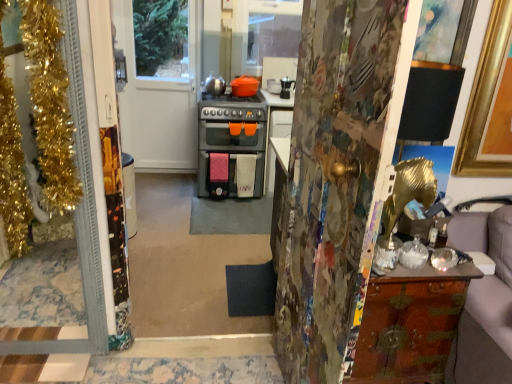
Where is `white glossy door at upper center, the 1th door from the back`? white glossy door at upper center, the 1th door from the back is located at coordinates (158, 83).

Locate an element on the screen. Image resolution: width=512 pixels, height=384 pixels. white glossy door at upper center, placed as the 3th door when sorted from front to back is located at coordinates (158, 83).

What's the angular difference between painted wood door at center, which is the 3th door in back-to-front order, and white glossy door at upper center, which is the 2th door in right-to-left order,'s facing directions?

84.4 degrees separate the facing orientations of painted wood door at center, which is the 3th door in back-to-front order, and white glossy door at upper center, which is the 2th door in right-to-left order.

At what (x,y) coordinates should I click in order to perform the action: click on the 2nd door below when counting from the white glossy door at upper center, which is the 2th door in left-to-right order (from the image's perspective). Please return your answer as a coordinate pair (x, y). This screenshot has height=384, width=512. Looking at the image, I should click on (338, 175).

Between painted wood door at center, marked as the 3th door in a left-to-right arrangement, and white glossy door at upper center, placed as the 3th door when sorted from front to back, which one has larger size?

painted wood door at center, marked as the 3th door in a left-to-right arrangement.

Considering the sizes of objects painted wood door at center, placed as the first door when sorted from front to back, and white glossy door at upper center, the 1th door from the back, in the image provided, who is wider, painted wood door at center, placed as the first door when sorted from front to back, or white glossy door at upper center, the 1th door from the back,?

painted wood door at center, placed as the first door when sorted from front to back, is wider.

Looking at this image, which is less distant, (177, 36) or (380, 319)?

The point (380, 319) is more forward.

Considering the sizes of objects white glossy door at upper center, the 1th door from the back, and wooden cabinet at right in the image provided, who is smaller, white glossy door at upper center, the 1th door from the back, or wooden cabinet at right?

white glossy door at upper center, the 1th door from the back, is smaller.

From a real-world perspective, between white glossy door at upper center, placed as the 3th door when sorted from front to back, and wooden cabinet at right, who is vertically lower?

wooden cabinet at right.

In the image, is white glossy door at upper center, which is the 2th door in right-to-left order, on the left side or the right side of wooden cabinet at right?

Based on their positions, white glossy door at upper center, which is the 2th door in right-to-left order, is located to the left of wooden cabinet at right.

Is wooden cabinet at right inside the boundaries of white glossy door at upper center, which is the 2th door in right-to-left order, or outside?

wooden cabinet at right exists outside the volume of white glossy door at upper center, which is the 2th door in right-to-left order.

How many degrees apart are the facing directions of wooden cabinet at right and white glossy door at upper center, which is the 2th door in right-to-left order?

1.07 degrees separate the facing orientations of wooden cabinet at right and white glossy door at upper center, which is the 2th door in right-to-left order.

Does wooden cabinet at right have a smaller size compared to white glossy door at upper center, the 1th door from the back?

No, wooden cabinet at right is not smaller than white glossy door at upper center, the 1th door from the back.

Which object is positioned more to the right, wooden cabinet at right or white glossy door at upper center, which is the 2th door in right-to-left order?

Positioned to the right is wooden cabinet at right.

From their relative heights in the image, would you say painted wood door at center, marked as the 3th door in a left-to-right arrangement, is taller or shorter than wooden cabinet at right?

Clearly, painted wood door at center, marked as the 3th door in a left-to-right arrangement, is taller compared to wooden cabinet at right.

In terms of size, does painted wood door at center, marked as the 1th door in a right-to-left arrangement, appear bigger or smaller than wooden cabinet at right?

Clearly, painted wood door at center, marked as the 1th door in a right-to-left arrangement, is larger in size than wooden cabinet at right.

Is painted wood door at center, marked as the 1th door in a right-to-left arrangement, to the left or to the right of wooden cabinet at right in the image?

In the image, painted wood door at center, marked as the 1th door in a right-to-left arrangement, appears on the left side of wooden cabinet at right.

Can you confirm if gold tinsel at left, positioned as the second door in back-to-front order, is positioned to the left of wooden cabinet at right?

Yes.

Looking at this image, which object is further away from the camera taking this photo, gold tinsel at left, the 3th door viewed from the right, or wooden cabinet at right?

wooden cabinet at right is further from the camera.

Who is smaller, gold tinsel at left, which is counted as the 2th door, starting from the front, or wooden cabinet at right?

Smaller between the two is gold tinsel at left, which is counted as the 2th door, starting from the front.

Is point (348, 55) behind point (104, 293)?

No, it is in front of (104, 293).

From a real-world perspective, is painted wood door at center, placed as the first door when sorted from front to back, on top of gold tinsel at left, the 3th door viewed from the right?

Correct, in the physical world, painted wood door at center, placed as the first door when sorted from front to back, is higher than gold tinsel at left, the 3th door viewed from the right.

Starting from the painted wood door at center, marked as the 1th door in a right-to-left arrangement, which door is the 2nd one to the left? Please provide its 2D coordinates.

[(84, 192)]

Can you confirm if painted wood door at center, marked as the 1th door in a right-to-left arrangement, is taller than gold tinsel at left, positioned as the second door in back-to-front order?

Yes, painted wood door at center, marked as the 1th door in a right-to-left arrangement, is taller than gold tinsel at left, positioned as the second door in back-to-front order.

From a real-world perspective, is wooden cabinet at right physically below gold tinsel at left, the 1th door viewed from the left?

Yes.

Is wooden cabinet at right turned away from gold tinsel at left, the 1th door viewed from the left?

No, gold tinsel at left, the 1th door viewed from the left, is not at the back of wooden cabinet at right.

Considering the sizes of objects wooden cabinet at right and gold tinsel at left, which is counted as the 2th door, starting from the front, in the image provided, who is taller, wooden cabinet at right or gold tinsel at left, which is counted as the 2th door, starting from the front,?

With more height is gold tinsel at left, which is counted as the 2th door, starting from the front.

Is wooden cabinet at right at the right side of gold tinsel at left, the 3th door viewed from the right?

Indeed, wooden cabinet at right is positioned on the right side of gold tinsel at left, the 3th door viewed from the right.

Identify the location of door located on the right of white glossy door at upper center, the 1th door from the back. This screenshot has width=512, height=384. (338, 175).

Locate an element on the screen. The image size is (512, 384). door that appears behind the wooden cabinet at right is located at coordinates (158, 83).

When comparing their distances from gold tinsel at left, which is counted as the 2th door, starting from the front, does painted wood door at center, marked as the 3th door in a left-to-right arrangement, or wooden cabinet at right seem closer?

painted wood door at center, marked as the 3th door in a left-to-right arrangement.

Considering their positions, is wooden cabinet at right positioned further to gold tinsel at left, positioned as the second door in back-to-front order, than painted wood door at center, placed as the first door when sorted from front to back?

wooden cabinet at right is further to gold tinsel at left, positioned as the second door in back-to-front order.

Based on their spatial positions, is gold tinsel at left, the 1th door viewed from the left, or painted wood door at center, placed as the first door when sorted from front to back, further from white glossy door at upper center, the 1th door from the back?

painted wood door at center, placed as the first door when sorted from front to back, is positioned further to the anchor white glossy door at upper center, the 1th door from the back.

Estimate the real-world distances between objects in this image. Which object is closer to painted wood door at center, placed as the first door when sorted from front to back, wooden cabinet at right or white glossy door at upper center, which is the 2th door in left-to-right order?

Among the two, wooden cabinet at right is located nearer to painted wood door at center, placed as the first door when sorted from front to back.

When comparing their distances from painted wood door at center, marked as the 3th door in a left-to-right arrangement, does white glossy door at upper center, which is the 2th door in right-to-left order, or wooden cabinet at right seem further?

white glossy door at upper center, which is the 2th door in right-to-left order, is positioned further to the anchor painted wood door at center, marked as the 3th door in a left-to-right arrangement.

Looking at the image, which one is located closer to white glossy door at upper center, which is the 2th door in left-to-right order, gold tinsel at left, which is counted as the 2th door, starting from the front, or wooden cabinet at right?

gold tinsel at left, which is counted as the 2th door, starting from the front, is closer to white glossy door at upper center, which is the 2th door in left-to-right order.

When comparing their distances from gold tinsel at left, positioned as the second door in back-to-front order, does white glossy door at upper center, which is the 2th door in left-to-right order, or wooden cabinet at right seem further?

white glossy door at upper center, which is the 2th door in left-to-right order, lies further to gold tinsel at left, positioned as the second door in back-to-front order, than the other object.

Based on the photo, considering their positions, is gold tinsel at left, the 1th door viewed from the left, positioned closer to painted wood door at center, marked as the 3th door in a left-to-right arrangement, than wooden cabinet at right?

The object closer to painted wood door at center, marked as the 3th door in a left-to-right arrangement, is wooden cabinet at right.

You are a GUI agent. You are given a task and a screenshot of the screen. Output one action in this format:
    pyautogui.click(x=<x>, y=<y>)
    Task: Click on the cabinetry between gold tinsel at left, the 1th door viewed from the left, and white glossy door at upper center, which is the 2th door in right-to-left order, from front to back
    The image size is (512, 384).
    Given the screenshot: What is the action you would take?
    [x=410, y=324]

Where is `cabinetry between painted wood door at center, marked as the 1th door in a right-to-left arrangement, and white glossy door at upper center, which is the 2th door in left-to-right order, from front to back`? cabinetry between painted wood door at center, marked as the 1th door in a right-to-left arrangement, and white glossy door at upper center, which is the 2th door in left-to-right order, from front to back is located at coordinates (410, 324).

I want to click on door between painted wood door at center, marked as the 1th door in a right-to-left arrangement, and white glossy door at upper center, placed as the 3th door when sorted from front to back, along the z-axis, so click(x=84, y=192).